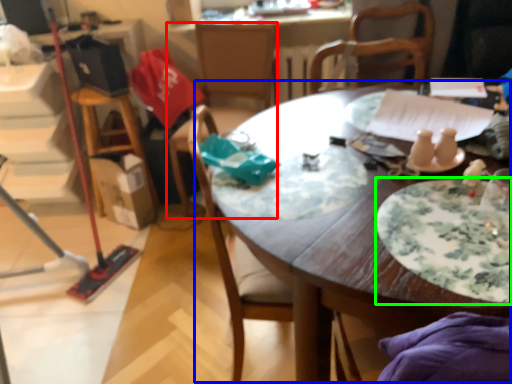
Question: Which is nearer to the chair (highlighted by a red box)? table (highlighted by a blue box) or plate (highlighted by a green box).

Choices:
 (A) table
 (B) plate

Answer: (A)